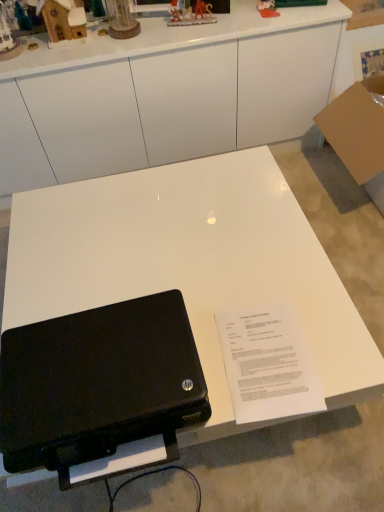
You are a GUI agent. You are given a task and a screenshot of the screen. Output one action in this format:
    pyautogui.click(x=<x>, y=<y>)
    Task: Click on the vacant space in between matte wooden clock at upper center, the third toy viewed from the right, and plastic toy at upper center, which is the 5th toy in left-to-right order
    
    Given the screenshot: What is the action you would take?
    pyautogui.click(x=192, y=22)